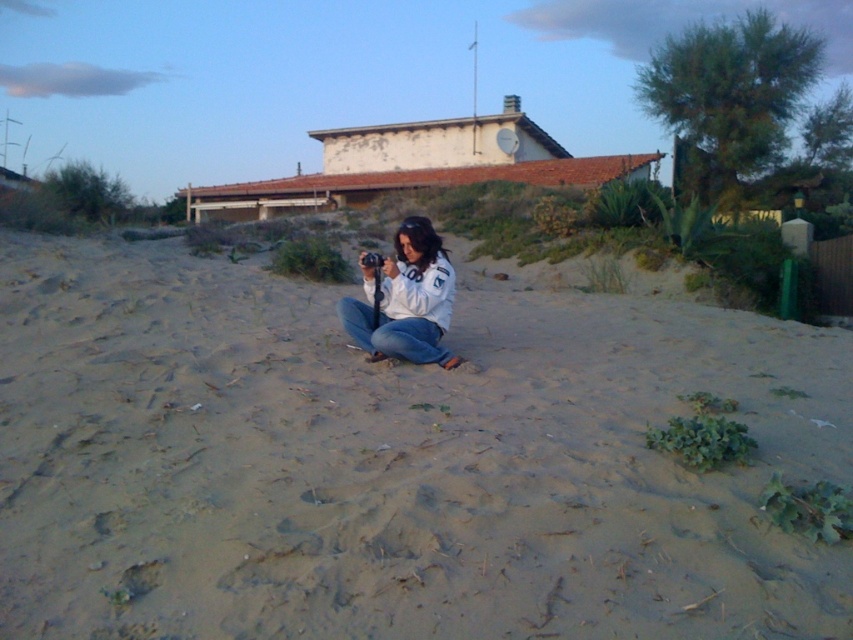
Question: Among these objects, which one is nearest to the camera?

Choices:
 (A) sandy beige sand at center
 (B) white matte jacket at center

Answer: (A)

Question: Is sandy beige sand at center positioned behind white matte jacket at center?

Choices:
 (A) yes
 (B) no

Answer: (B)

Question: Does sandy beige sand at center have a lesser width compared to white matte jacket at center?

Choices:
 (A) yes
 (B) no

Answer: (B)

Question: Which point appears closest to the camera in this image?

Choices:
 (A) (474, 356)
 (B) (437, 282)

Answer: (B)

Question: Considering the relative positions of sandy beige sand at center and white matte jacket at center in the image provided, where is sandy beige sand at center located with respect to white matte jacket at center?

Choices:
 (A) below
 (B) above

Answer: (A)